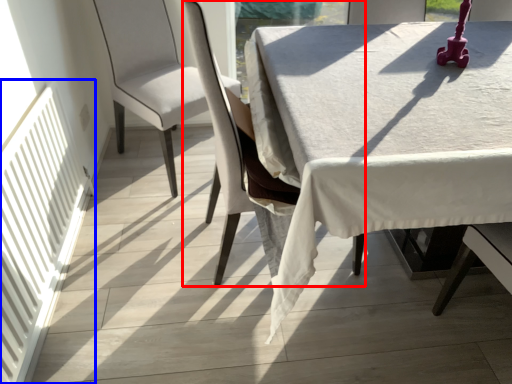
Question: Which of the following is the closest to the observer, chair (highlighted by a red box) or radiator (highlighted by a blue box)?

Choices:
 (A) chair
 (B) radiator

Answer: (B)